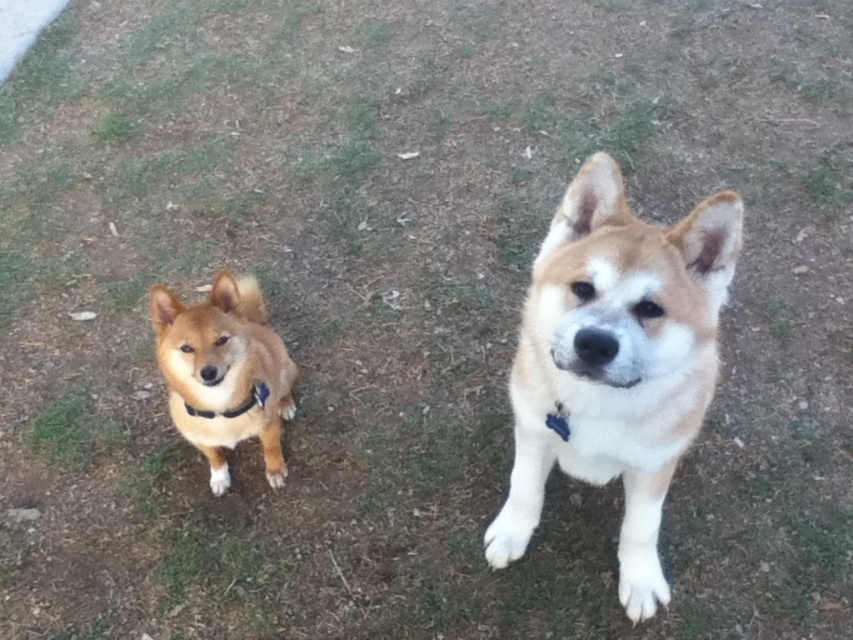
How much distance is there between light brown fur dog at center and black fabric neckband at lower left?

A distance of 30.93 inches exists between light brown fur dog at center and black fabric neckband at lower left.

Can you confirm if light brown fur dog at center is bigger than black fabric neckband at lower left?

Indeed, light brown fur dog at center has a larger size compared to black fabric neckband at lower left.

Between point (512, 528) and point (241, 413), which one is positioned in front?

Point (241, 413) is more forward.

The width and height of the screenshot is (853, 640). I want to click on light brown fur dog at center, so click(x=614, y=362).

Can you confirm if brown fur dog at left is positioned below black fabric neckband at lower left?

No.

Does point (218, 285) come in front of point (262, 384)?

Yes.

I want to click on brown fur dog at left, so click(x=224, y=372).

Who is more forward, (666, 461) or (248, 381)?

Positioned in front is point (666, 461).

The image size is (853, 640). What do you see at coordinates (614, 362) in the screenshot?
I see `light brown fur dog at center` at bounding box center [614, 362].

This screenshot has height=640, width=853. What do you see at coordinates (614, 362) in the screenshot?
I see `light brown fur dog at center` at bounding box center [614, 362].

Locate an element on the screen. light brown fur dog at center is located at coordinates (614, 362).